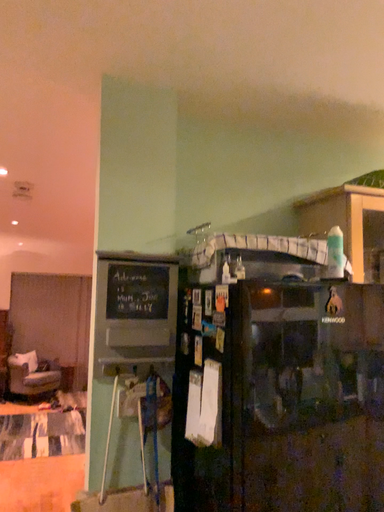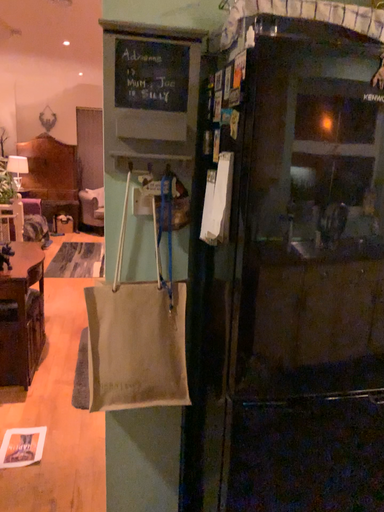
Question: Which way did the camera rotate in the video?

Choices:
 (A) rotated left
 (B) rotated right

Answer: (A)